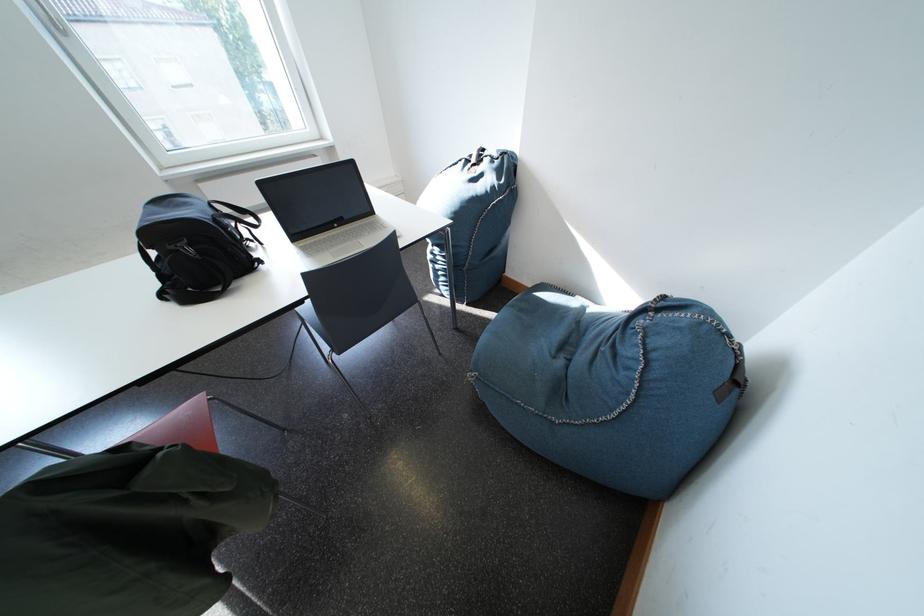
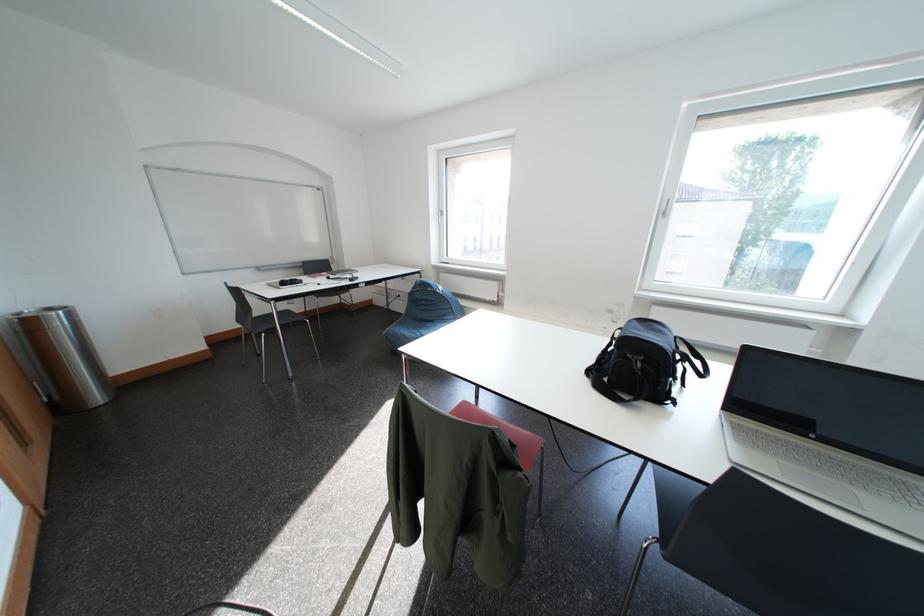
Question: The camera is either moving clockwise (left) or counter-clockwise (right) around the object. The first image is from the beginning of the video and the second image is from the end. Is the camera moving left or right when shooting the video?

Choices:
 (A) Left
 (B) Right

Answer: (B)